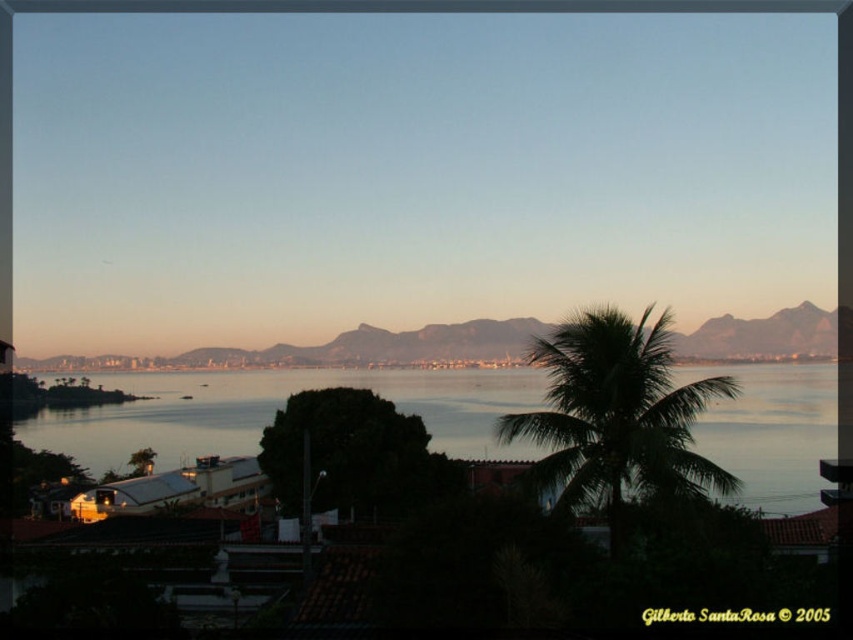
Question: Is blue sky at upper center wider than clear water at center?

Choices:
 (A) yes
 (B) no

Answer: (A)

Question: Can you confirm if clear water at center is positioned above rocky brown mountain at center?

Choices:
 (A) yes
 (B) no

Answer: (B)

Question: Which object is positioned closest to the clear water at center?

Choices:
 (A) rocky brown mountain at center
 (B) green leafy palm tree at center

Answer: (A)

Question: Can you confirm if clear water at center is positioned to the right of rocky brown mountain at center?

Choices:
 (A) yes
 (B) no

Answer: (A)

Question: Considering the real-world distances, which object is farthest from the rocky brown mountain at center?

Choices:
 (A) green leafy palm tree at center
 (B) clear water at center

Answer: (A)

Question: Which point is closer to the camera?

Choices:
 (A) blue sky at upper center
 (B) rocky brown mountain at center
 (C) clear water at center
 (D) green leafy palm tree at center

Answer: (D)